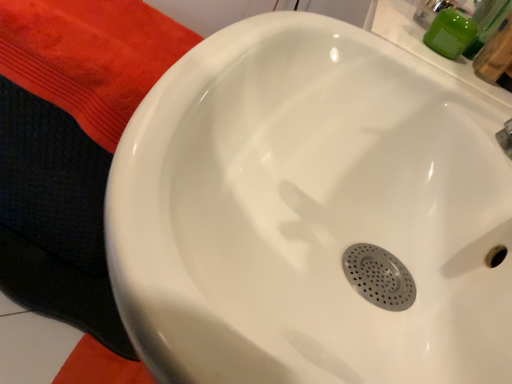
Question: From the image's perspective, is silver metallic faucet at upper right above or below green matte soap dispenser at upper right?

Choices:
 (A) below
 (B) above

Answer: (A)

Question: Is silver metallic faucet at upper right taller or shorter than green matte soap dispenser at upper right?

Choices:
 (A) short
 (B) tall

Answer: (B)

Question: Is silver metallic faucet at upper right in front of or behind green matte soap dispenser at upper right in the image?

Choices:
 (A) behind
 (B) front

Answer: (B)

Question: In terms of size, does green matte soap dispenser at upper right appear bigger or smaller than silver metallic faucet at upper right?

Choices:
 (A) big
 (B) small

Answer: (B)

Question: From a real-world perspective, is green matte soap dispenser at upper right above or below silver metallic faucet at upper right?

Choices:
 (A) below
 (B) above

Answer: (A)

Question: In terms of height, does green matte soap dispenser at upper right look taller or shorter compared to silver metallic faucet at upper right?

Choices:
 (A) tall
 (B) short

Answer: (B)

Question: Is green matte soap dispenser at upper right wider or thinner than silver metallic faucet at upper right?

Choices:
 (A) wide
 (B) thin

Answer: (B)